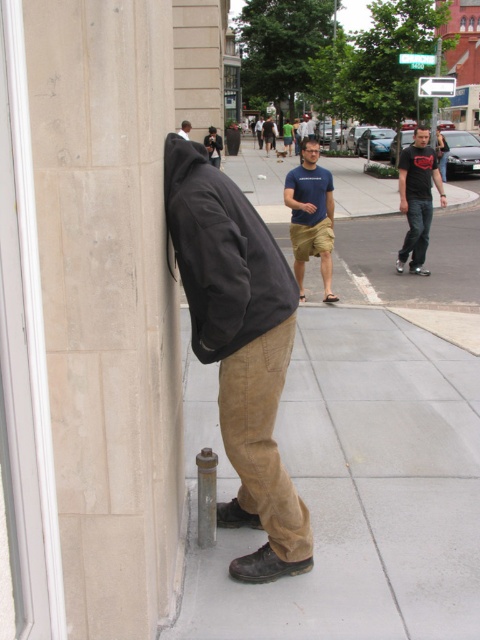
Question: Does black matte jacket at left appear on the right side of black matte jacket at upper left?

Choices:
 (A) yes
 (B) no

Answer: (A)

Question: Estimate the real-world distances between objects in this image. Which object is farther from the black matte jacket at upper left?

Choices:
 (A) black cotton t-shirt at center-right
 (B) black matte jacket at left
 (C) dark gray hoodie at left
 (D) blue cotton t-shirt at center

Answer: (C)

Question: Based on their relative distances, which object is farther from the black matte jacket at left?

Choices:
 (A) blue cotton t-shirt at center
 (B) black cotton t-shirt at center-right

Answer: (B)

Question: Among these objects, which one is farthest from the camera?

Choices:
 (A) blue cotton t-shirt at center
 (B) dark gray hoodie at left
 (C) black cotton t-shirt at center-right
 (D) black matte jacket at upper left

Answer: (D)

Question: Is black matte jacket at left positioned at the back of blue cotton t-shirt at center?

Choices:
 (A) yes
 (B) no

Answer: (B)

Question: Can you confirm if blue cotton t-shirt at center is bigger than black cotton t-shirt at center-right?

Choices:
 (A) yes
 (B) no

Answer: (A)